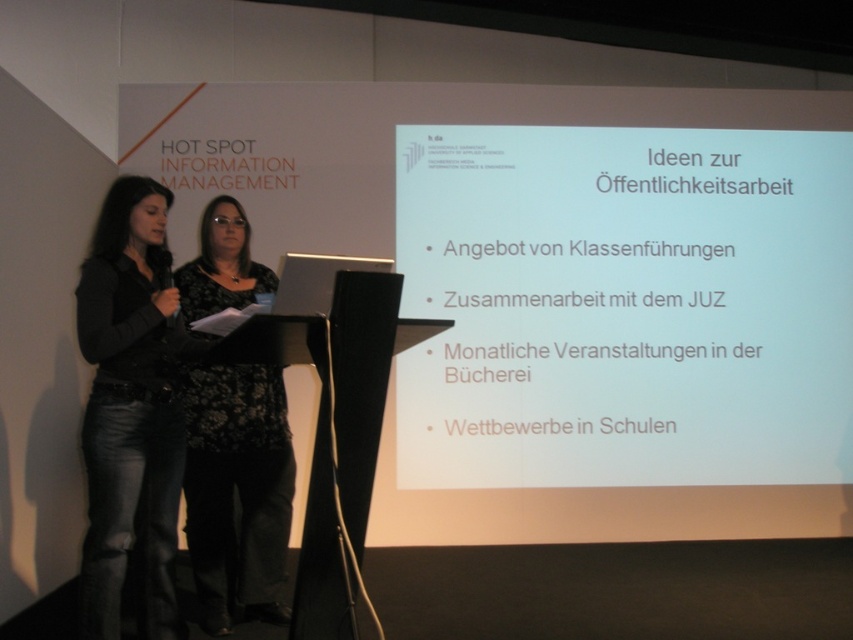
You are an event planner preparing for a presentation. You need to ensure that the white matte projector screen at upper center and the black floral dress at center are visible to the audience. Considering their sizes, which object will appear larger to the audience?

The white matte projector screen at upper center is bigger than the black floral dress at center, so the white matte projector screen at upper center will appear larger to the audience.

You are a photographer positioned at the front of the room. You need to capture a photo that includes both the white matte projector screen at upper center and the denim jeans at left. Given that your camera has a maximum focus range of 7 feet, will you be able to capture both objects in focus without moving?

The distance between the white matte projector screen at upper center and the denim jeans at left is 7.82 feet. Since the camera can only focus within 7 feet, the objects are beyond the maximum focus range. Therefore, you cannot capture both in focus without moving closer or adjusting your position.

You are organizing a charity event and need to decide which attendee to approach first based on their clothing size. You see a denim jeans at left and a black floral dress at center. Which clothing item belongs to a person with a larger body size?

The black floral dress at center belongs to a person with a larger body size since the denim jeans at left is smaller than the black floral dress at center.